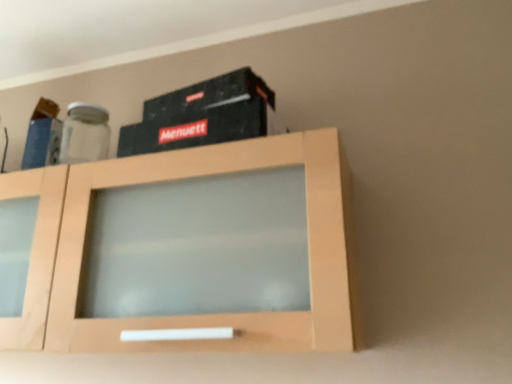
Question: Is point (152, 147) positioned closer to the camera than point (270, 188)?

Choices:
 (A) closer
 (B) farther

Answer: (B)

Question: Is black matte box at upper center in front of or behind light wood cabinet at center in the image?

Choices:
 (A) front
 (B) behind

Answer: (B)

Question: Considering the relative positions of black matte box at upper center and light wood cabinet at center in the image provided, is black matte box at upper center to the left or to the right of light wood cabinet at center?

Choices:
 (A) right
 (B) left

Answer: (A)

Question: Does point (49, 208) appear closer or farther from the camera than point (183, 105)?

Choices:
 (A) farther
 (B) closer

Answer: (B)

Question: In the image, is light wood cabinet at center on the left side or the right side of black matte box at upper center?

Choices:
 (A) left
 (B) right

Answer: (A)

Question: Is light wood cabinet at center situated inside black matte box at upper center or outside?

Choices:
 (A) outside
 (B) inside

Answer: (A)

Question: From the image's perspective, relative to black matte box at upper center, is light wood cabinet at center above or below?

Choices:
 (A) above
 (B) below

Answer: (B)